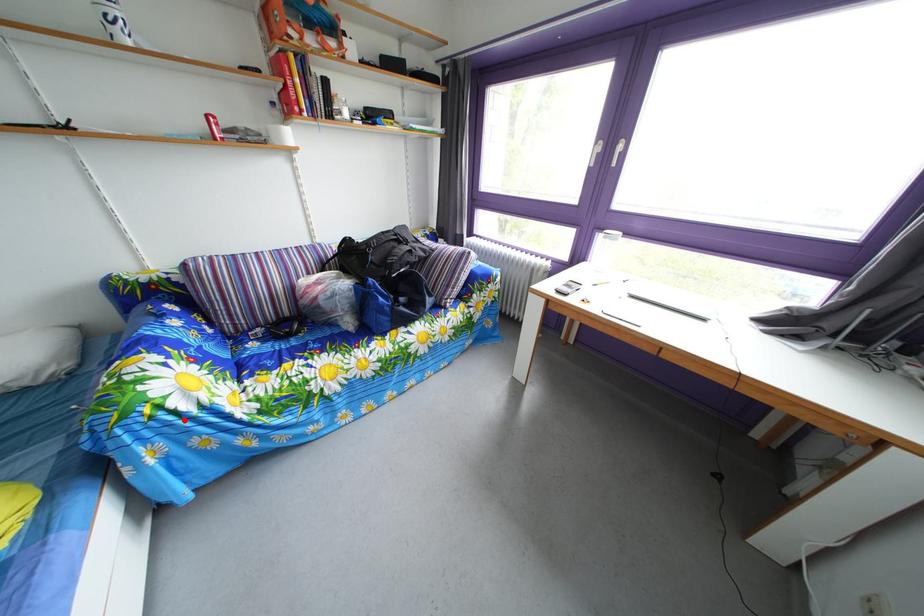
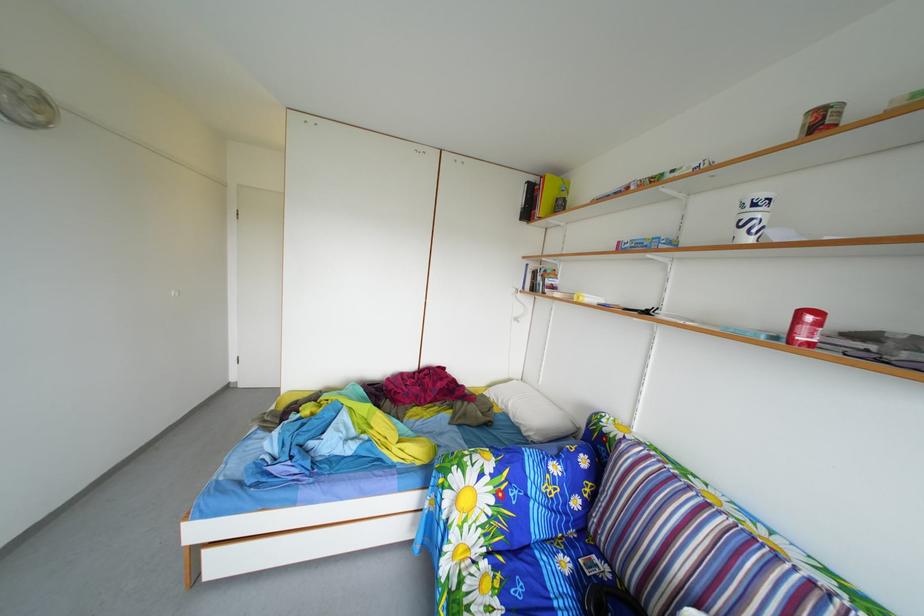
Question: I am providing you with two images of the same scene from different viewpoints. Image1 has a red point marked. In image2, the corresponding 3D location appears at what relative position? Reply with the corresponding letter.

Choices:
 (A) Closer
 (B) Farther

Answer: (B)